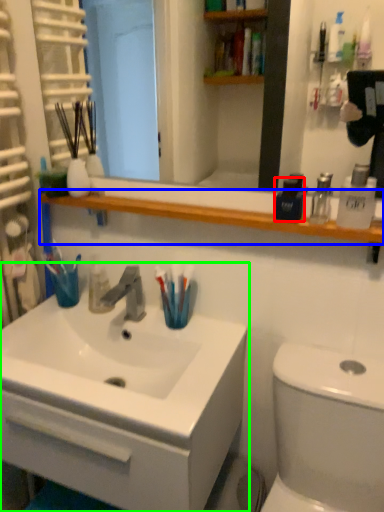
Question: Which object is the closest to the mouthwash (highlighted by a red box)? Choose among these: balustrade (highlighted by a blue box) or bathroom cabinet (highlighted by a green box).

Choices:
 (A) balustrade
 (B) bathroom cabinet

Answer: (A)